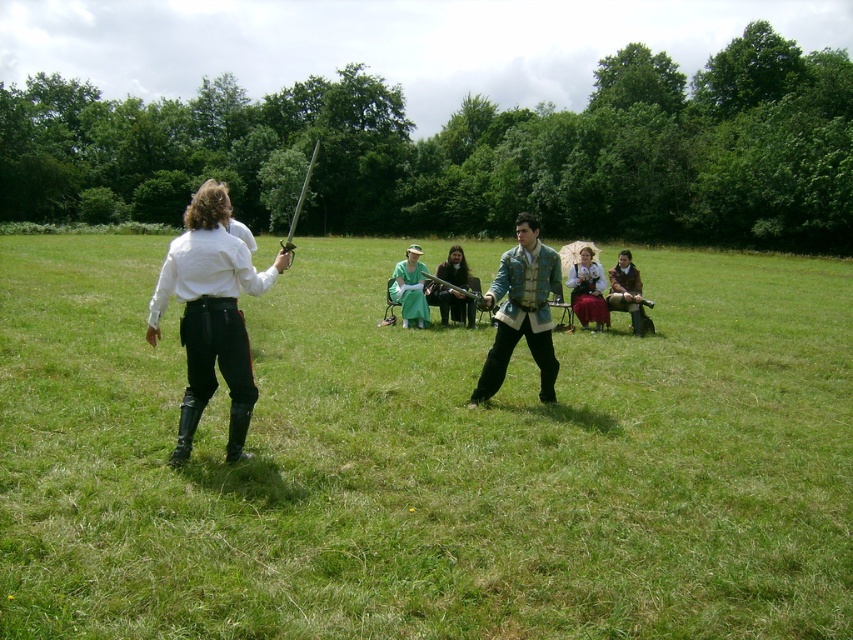
Can you confirm if brown leather jacket at center is taller than shiny silver sword at center?

In fact, brown leather jacket at center may be shorter than shiny silver sword at center.

Which is behind, point (631, 317) or point (292, 221)?

The point (292, 221) is more distant.

Is point (624, 291) positioned behind point (292, 224)?

No, (624, 291) is closer to viewer.

At what (x,y) coordinates should I click in order to perform the action: click on brown leather jacket at center. Please return your answer as a coordinate pair (x, y). Looking at the image, I should click on (627, 291).

Can you confirm if green grass at center is shorter than shiny silver sword at center?

Result: Yes, green grass at center is shorter than shiny silver sword at center.

Does green grass at center appear under shiny silver sword at center?

Yes, green grass at center is below shiny silver sword at center.

Locate an element on the screen. This screenshot has height=640, width=853. green grass at center is located at coordinates (425, 460).

Can you confirm if brown leather jacket at center is bigger than green satin dress at center?

Incorrect, brown leather jacket at center is not larger than green satin dress at center.

Measure the distance from brown leather jacket at center to green satin dress at center.

brown leather jacket at center is 3.38 meters from green satin dress at center.

The width and height of the screenshot is (853, 640). Describe the element at coordinates (627, 291) in the screenshot. I see `brown leather jacket at center` at that location.

Where is `brown leather jacket at center`? brown leather jacket at center is located at coordinates (627, 291).